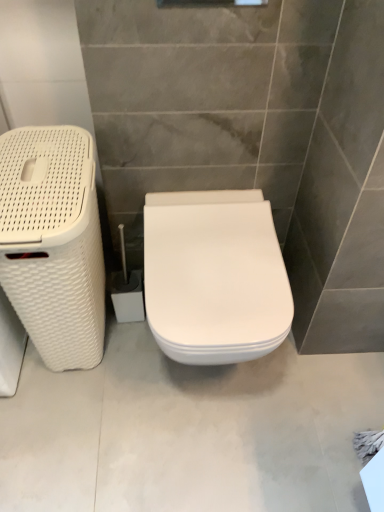
What do you see at coordinates (214, 276) in the screenshot? I see `white glossy toilet at center` at bounding box center [214, 276].

In the scene shown: Measure the distance between point [231,339] and camera.

The depth of point [231,339] is 35.75 inches.

The width and height of the screenshot is (384, 512). What are the coordinates of `white glossy toilet at center` in the screenshot? It's located at (188, 431).

You are a GUI agent. You are given a task and a screenshot of the screen. Output one action in this format:
    pyautogui.click(x=<x>, y=<y>)
    Task: Click on the white woven laundry basket at left
    This screenshot has height=512, width=384.
    Given the screenshot: What is the action you would take?
    pyautogui.click(x=53, y=242)

Which is more to the left, white glossy toilet at center or white woven laundry basket at left?

From the viewer's perspective, white woven laundry basket at left appears more on the left side.

Which of these two, white glossy toilet at center or white woven laundry basket at left, is bigger?

white woven laundry basket at left is bigger.

Which is further, (x=247, y=448) or (x=27, y=141)?

The point (x=247, y=448) is farther from the camera.

Is white glossy toilet at center beside white woven laundry basket at left?

No.

From the image's perspective, is white woven laundry basket at left below white glossy toilet at center?

Actually, white woven laundry basket at left appears above white glossy toilet at center in the image.

Is point (18, 245) positioned behind point (263, 204)?

No, it is not.

How different are the orientations of white woven laundry basket at left and white glossy toilet at center in degrees?

The angular difference between white woven laundry basket at left and white glossy toilet at center is 0.366 degrees.

Which of these two, white woven laundry basket at left or white glossy toilet at center, is bigger?

white woven laundry basket at left is bigger.

Is white woven laundry basket at left facing towards white glossy toilet at center?

No, white woven laundry basket at left is not oriented towards white glossy toilet at center.

Is white woven laundry basket at left spatially inside white glossy toilet at center, or outside of it?

The correct answer is: outside.

Would you say white woven laundry basket at left is a long distance from white glossy toilet at center?

No, white woven laundry basket at left is in close proximity to white glossy toilet at center.

Is white woven laundry basket at left inside white glossy toilet at center?

No, white woven laundry basket at left is not a part of white glossy toilet at center.

Is white glossy toilet at center facing towards white woven laundry basket at left?

No.

Based on the photo, from the image's perspective, is white glossy toilet at center above or below white woven laundry basket at left?

white glossy toilet at center is below white woven laundry basket at left.

Is white glossy toilet at center far away from white glossy toilet at center?

Actually, white glossy toilet at center and white glossy toilet at center are a little close together.

How distant is white glossy toilet at center from white glossy toilet at center?

A distance of 16.39 inches exists between white glossy toilet at center and white glossy toilet at center.

In the scene shown: In the image, is white glossy toilet at center positioned in front of or behind white glossy toilet at center?

Clearly, white glossy toilet at center is in front of white glossy toilet at center.

Could white glossy toilet at center be considered to be inside white glossy toilet at center?

No, white glossy toilet at center is not surrounded by white glossy toilet at center.

From the image's perspective, who appears lower, white glossy toilet at center or white glossy toilet at center?

From the image's view, white glossy toilet at center is below.

Does white glossy toilet at center have a lesser width compared to white glossy toilet at center?

In fact, white glossy toilet at center might be wider than white glossy toilet at center.

Does white glossy toilet at center appear on the right side of white glossy toilet at center?

No.

Considering the sizes of objects white glossy toilet at center and white glossy toilet at center in the image provided, who is taller, white glossy toilet at center or white glossy toilet at center?

With more height is white glossy toilet at center.

At what (x,y) coordinates should I click in order to perform the action: click on concrete below the white woven laundry basket at left (from the image's perspective). Please return your answer as a coordinate pair (x, y). Looking at the image, I should click on (188, 431).

The image size is (384, 512). What are the coordinates of `laundry basket that appears on the left of white glossy toilet at center` in the screenshot? It's located at (53, 242).

Which object lies further to the anchor point white glossy toilet at center, white woven laundry basket at left or white glossy toilet at center?

Based on the image, white glossy toilet at center appears to be further to white glossy toilet at center.

Based on their spatial positions, is white glossy toilet at center or white glossy toilet at center closer to white woven laundry basket at left?

Among the two, white glossy toilet at center is located nearer to white woven laundry basket at left.

Considering their positions, is white woven laundry basket at left positioned closer to white glossy toilet at center than white glossy toilet at center?

Among the two, white glossy toilet at center is located nearer to white glossy toilet at center.

Based on the photo, when comparing their distances from white glossy toilet at center, does white glossy toilet at center or white woven laundry basket at left seem closer?

white glossy toilet at center.

Estimate the real-world distances between objects in this image. Which object is further from white woven laundry basket at left, white glossy toilet at center or white glossy toilet at center?

white glossy toilet at center.

When comparing their distances from white glossy toilet at center, does white glossy toilet at center or white woven laundry basket at left seem closer?

white woven laundry basket at left.

Identify the location of concrete between white woven laundry basket at left and white glossy toilet at center from left to right. (188, 431).